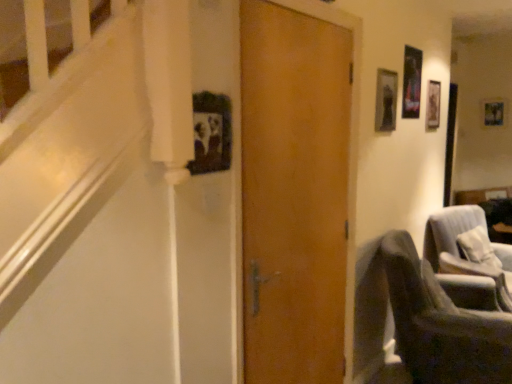
Question: Is dark gray fabric chair at lower right, which ranks as the 1th chair in front-to-back order, wider than metallic silver picture frame at upper right, arranged as the 1th picture frame when viewed from the front?

Choices:
 (A) yes
 (B) no

Answer: (A)

Question: Is dark gray fabric chair at lower right, which ranks as the 1th chair in front-to-back order, taller than metallic silver picture frame at upper right, which is counted as the second picture frame, starting from the right?

Choices:
 (A) no
 (B) yes

Answer: (B)

Question: Does dark gray fabric chair at lower right, which ranks as the 1th chair in front-to-back order, have a smaller size compared to metallic silver picture frame at upper right, which is counted as the second picture frame, starting from the right?

Choices:
 (A) yes
 (B) no

Answer: (B)

Question: From the image's perspective, is dark gray fabric chair at lower right, which ranks as the 1th chair in front-to-back order, below metallic silver picture frame at upper right, placed as the 2th picture frame when sorted from back to front?

Choices:
 (A) yes
 (B) no

Answer: (A)

Question: Does dark gray fabric chair at lower right, acting as the second chair starting from the back, have a lesser height compared to metallic silver picture frame at upper right, arranged as the 1th picture frame when viewed from the front?

Choices:
 (A) no
 (B) yes

Answer: (A)

Question: From a real-world perspective, does dark gray fabric chair at lower right, which ranks as the 1th chair in front-to-back order, stand above metallic silver picture frame at upper right, which is counted as the 1th picture frame, starting from the bottom?

Choices:
 (A) yes
 (B) no

Answer: (B)

Question: From a real-world perspective, is metallic silver picture frame at upper right, the 1th picture frame positioned from the left, below wooden door at center?

Choices:
 (A) yes
 (B) no

Answer: (B)

Question: Does metallic silver picture frame at upper right, arranged as the 1th picture frame when viewed from the front, have a lesser width compared to wooden door at center?

Choices:
 (A) no
 (B) yes

Answer: (B)

Question: Is metallic silver picture frame at upper right, the 1th picture frame positioned from the left, outside of wooden door at center?

Choices:
 (A) yes
 (B) no

Answer: (A)

Question: Does metallic silver picture frame at upper right, arranged as the 1th picture frame when viewed from the front, have a smaller size compared to wooden door at center?

Choices:
 (A) yes
 (B) no

Answer: (A)

Question: Is the depth of metallic silver picture frame at upper right, the 1th picture frame positioned from the left, greater than that of wooden door at center?

Choices:
 (A) yes
 (B) no

Answer: (A)

Question: From a real-world perspective, is metallic silver picture frame at upper right, which appears as the second picture frame when viewed from the top, located higher than wooden door at center?

Choices:
 (A) yes
 (B) no

Answer: (A)

Question: Considering the relative sizes of metallic silver picture frame at upper right, the 1th picture frame positioned from the left, and wooden photo frame at upper right, placed as the 1th picture frame when sorted from top to bottom, in the image provided, is metallic silver picture frame at upper right, the 1th picture frame positioned from the left, smaller than wooden photo frame at upper right, placed as the 1th picture frame when sorted from top to bottom,?

Choices:
 (A) yes
 (B) no

Answer: (B)